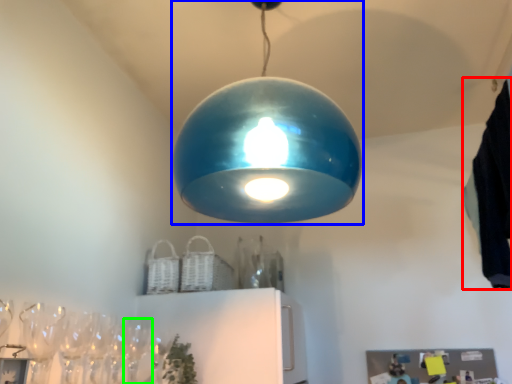
Question: Estimate the real-world distances between objects in this image. Which object is closer to laundry (highlighted by a red box), lamp (highlighted by a blue box) or wine glass (highlighted by a green box)?

Choices:
 (A) lamp
 (B) wine glass

Answer: (A)